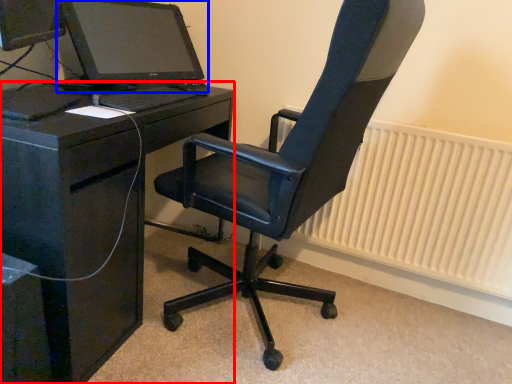
Question: Which point is closer to the camera, desk (highlighted by a red box) or computer monitor (highlighted by a blue box)?

Choices:
 (A) desk
 (B) computer monitor

Answer: (A)